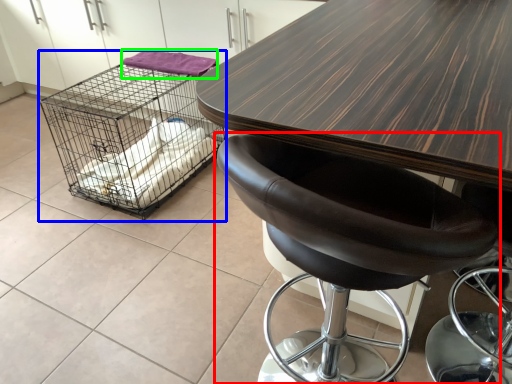
Question: Considering the real-world distances, which object is farthest from chair (highlighted by a red box)? bird cage (highlighted by a blue box) or material (highlighted by a green box)?

Choices:
 (A) bird cage
 (B) material

Answer: (A)